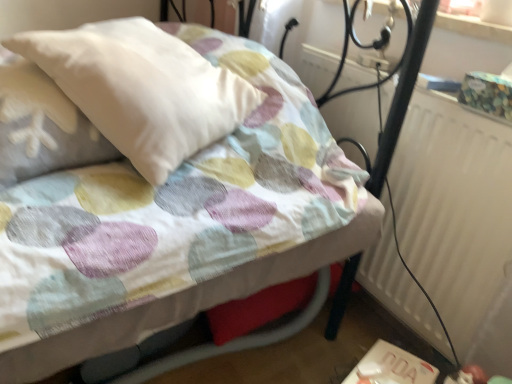
Question: Is white textured radiator at right taller or shorter than white soft pillow at upper left?

Choices:
 (A) short
 (B) tall

Answer: (B)

Question: Based on their positions, is white textured radiator at right located to the left or right of white soft pillow at upper left?

Choices:
 (A) right
 (B) left

Answer: (A)

Question: Which of these objects is positioned farthest from the white textured radiator at right?

Choices:
 (A) white soft pillow at upper left
 (B) white plastic table at lower right

Answer: (A)

Question: Which is nearer to the white textured radiator at right?

Choices:
 (A) white soft pillow at upper left
 (B) white plastic table at lower right

Answer: (B)